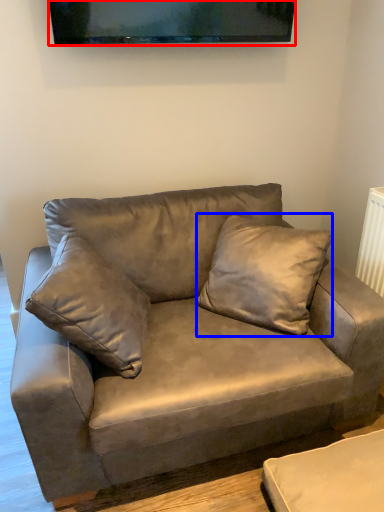
Question: Which of the following is the farthest to the observer, television (highlighted by a red box) or pillow (highlighted by a blue box)?

Choices:
 (A) television
 (B) pillow

Answer: (A)